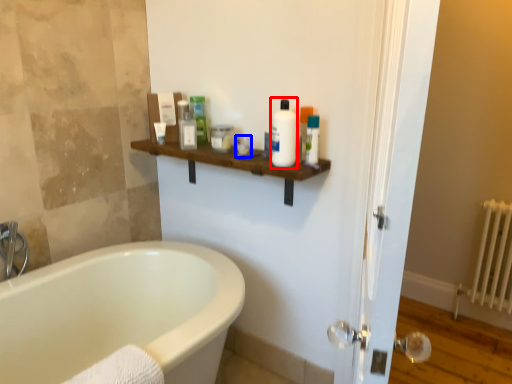
Question: Which object is closer to the camera taking this photo, cleaning product (highlighted by a red box) or toiletry (highlighted by a blue box)?

Choices:
 (A) cleaning product
 (B) toiletry

Answer: (A)